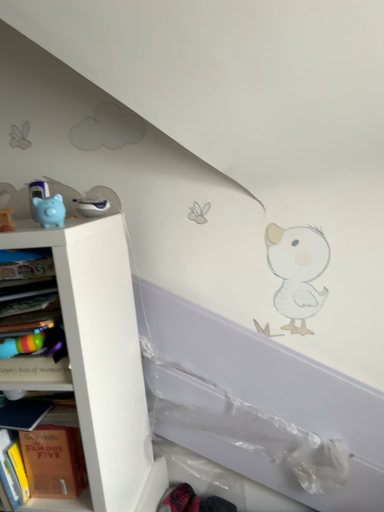
Question: From a real-world perspective, is multicolored plastic bookshelf at left under blue rubber piggy bank at left?

Choices:
 (A) no
 (B) yes

Answer: (B)

Question: Does multicolored plastic bookshelf at left appear on the left side of blue rubber piggy bank at left?

Choices:
 (A) yes
 (B) no

Answer: (A)

Question: Is multicolored plastic bookshelf at left at the right side of blue rubber piggy bank at left?

Choices:
 (A) no
 (B) yes

Answer: (A)

Question: Is multicolored plastic bookshelf at left placed right next to blue rubber piggy bank at left?

Choices:
 (A) yes
 (B) no

Answer: (B)

Question: From a real-world perspective, is multicolored plastic bookshelf at left positioned over blue rubber piggy bank at left based on gravity?

Choices:
 (A) yes
 (B) no

Answer: (B)

Question: In the image, is multicolored plastic bookshelf at left positioned in front of or behind white matte shelf at left, which appears as the second shelf when viewed from the top?

Choices:
 (A) behind
 (B) front

Answer: (B)

Question: From a real-world perspective, is multicolored plastic bookshelf at left above or below white matte shelf at left, which appears as the second shelf when viewed from the top?

Choices:
 (A) below
 (B) above

Answer: (B)

Question: In the image, is multicolored plastic bookshelf at left on the left side or the right side of white matte shelf at left, which is the 1th shelf in bottom-to-top order?

Choices:
 (A) left
 (B) right

Answer: (B)

Question: From the image's perspective, is multicolored plastic bookshelf at left positioned above or below white matte shelf at left, which appears as the second shelf when viewed from the top?

Choices:
 (A) above
 (B) below

Answer: (A)

Question: Considering the relative positions of white matte shelf at left, which is the 1th shelf in bottom-to-top order, and blue rubber piggy bank at left in the image provided, is white matte shelf at left, which is the 1th shelf in bottom-to-top order, to the left or to the right of blue rubber piggy bank at left?

Choices:
 (A) left
 (B) right

Answer: (A)

Question: Relative to blue rubber piggy bank at left, is white matte shelf at left, which appears as the second shelf when viewed from the top, in front or behind?

Choices:
 (A) front
 (B) behind

Answer: (A)

Question: Considering the positions of white matte shelf at left, which is the 1th shelf in bottom-to-top order, and blue rubber piggy bank at left in the image, is white matte shelf at left, which is the 1th shelf in bottom-to-top order, bigger or smaller than blue rubber piggy bank at left?

Choices:
 (A) big
 (B) small

Answer: (A)

Question: From the image's perspective, is white matte shelf at left, which appears as the second shelf when viewed from the top, located above or below blue rubber piggy bank at left?

Choices:
 (A) above
 (B) below

Answer: (B)

Question: From the image's perspective, is hardcover book at left, the first shelf viewed from the top, positioned above or below multicolored plastic bookshelf at left?

Choices:
 (A) below
 (B) above

Answer: (A)

Question: Is point (29, 485) positioned closer to the camera than point (51, 375)?

Choices:
 (A) farther
 (B) closer

Answer: (A)